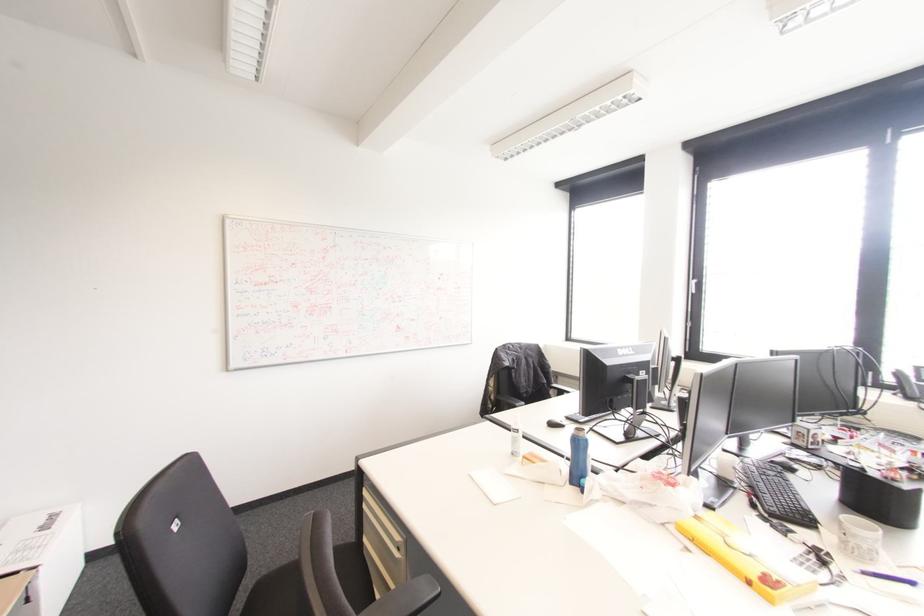
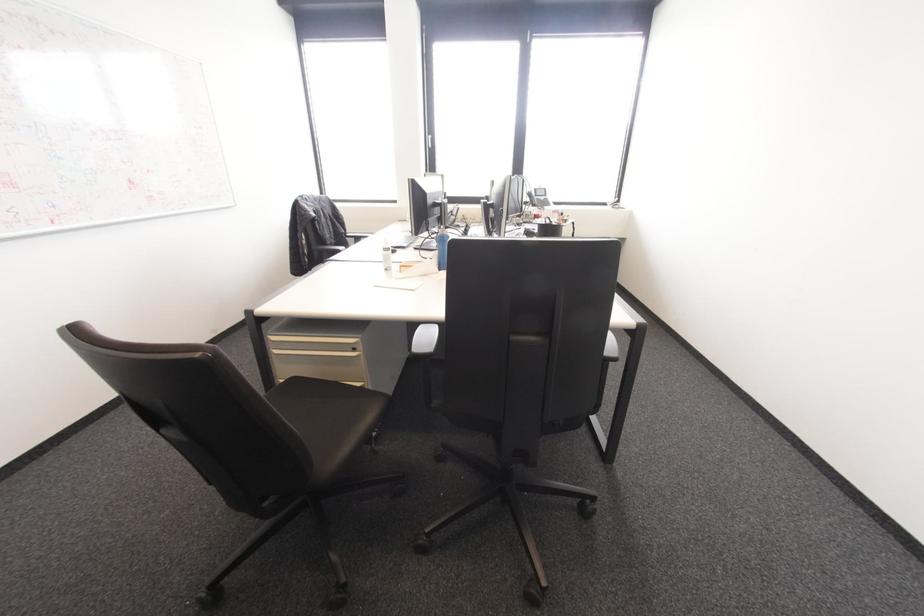
In the second image, find the point that corresponds to the point at 570,482 in the first image.

(440, 270)